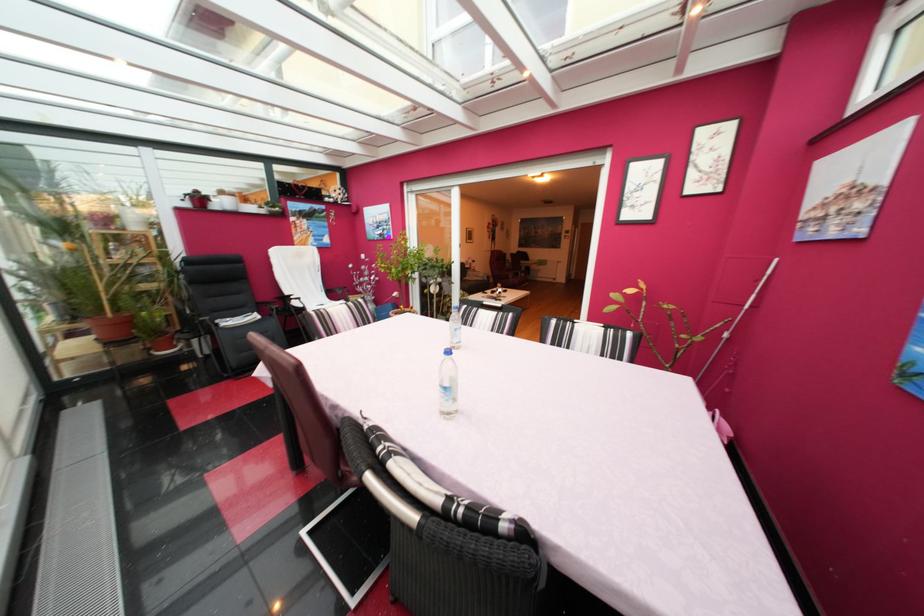
Find where to pull the sliding door handle. Please return your answer as a coordinate pair (x, y).

(737, 317)